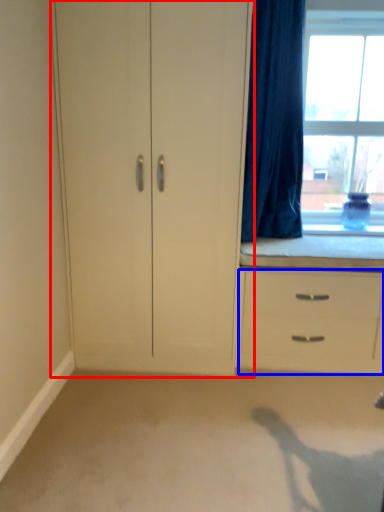
Question: Among these objects, which one is farthest to the camera, cupboard (highlighted by a red box) or chest of drawers (highlighted by a blue box)?

Choices:
 (A) cupboard
 (B) chest of drawers

Answer: (B)